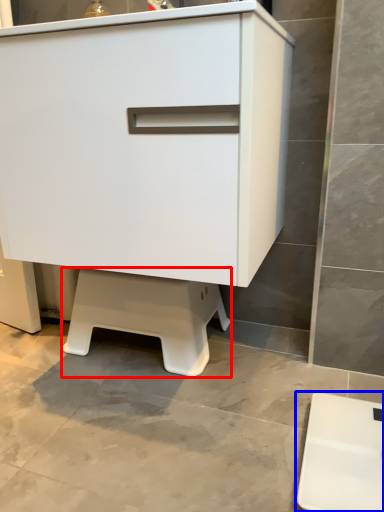
Question: Among these objects, which one is farthest to the camera, step stool (highlighted by a red box) or furniture (highlighted by a blue box)?

Choices:
 (A) step stool
 (B) furniture

Answer: (A)